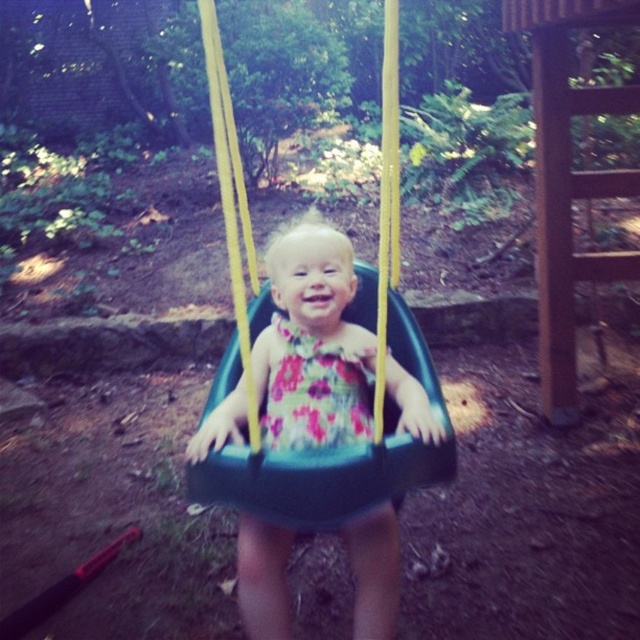
Which is in front, point (298, 241) or point (369, 372)?

Point (298, 241)

Is floral dress at center closer to camera compared to floral fabric dress at center?

Yes, it is.

Identify the location of floral dress at center. (312, 340).

Can you confirm if floral dress at center is smaller than black plastic swing at center?

Incorrect, floral dress at center is not smaller in size than black plastic swing at center.

Does floral dress at center have a greater width compared to black plastic swing at center?

Correct, the width of floral dress at center exceeds that of black plastic swing at center.

This screenshot has height=640, width=640. In order to click on floral dress at center in this screenshot , I will do `click(312, 340)`.

Does black plastic swing at center have a lesser height compared to floral fabric dress at center?

Incorrect, black plastic swing at center's height does not fall short of floral fabric dress at center's.

From the picture: Who is shorter, black plastic swing at center or floral fabric dress at center?

floral fabric dress at center

Is point (236, 182) positioned before point (324, 410)?

Yes, point (236, 182) is in front of point (324, 410).

I want to click on black plastic swing at center, so point(230,198).